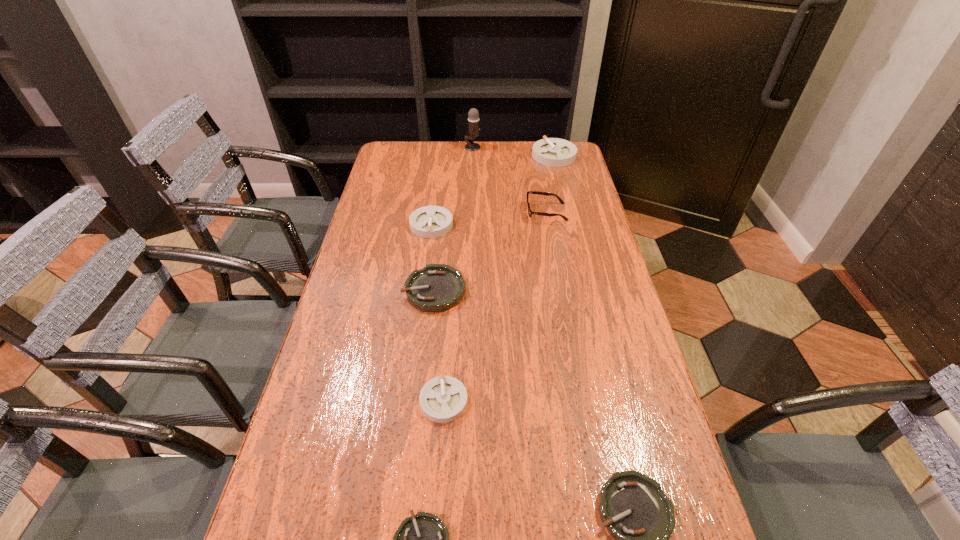
You are a GUI agent. You are given a task and a screenshot of the screen. Output one action in this format:
    pyautogui.click(x=<x>, y=<y>)
    Task: Click on the gray microphone
    Image resolution: width=960 pixels, height=540 pixels.
    Given the screenshot: What is the action you would take?
    click(x=473, y=115)

I want to click on the tallest object, so click(473, 115).

Identify the location of the farthest gray ashtray. (554, 152).

The image size is (960, 540). Identify the location of the tallest ashtray. (554, 152).

What are the coordinates of `spectacles` in the screenshot? It's located at (x=530, y=212).

Locate an element on the screen. the second nearest gray ashtray is located at coordinates (429, 221).

I want to click on the fourth tallest object, so click(x=429, y=221).

This screenshot has height=540, width=960. In order to click on the biggest green ashtray in this screenshot , I will do `click(437, 287)`.

The width and height of the screenshot is (960, 540). I want to click on the fourth nearest object, so click(437, 287).

At what (x,y) coordinates should I click in order to perform the action: click on the smallest gray ashtray. Please return your answer as a coordinate pair (x, y). The image size is (960, 540). Looking at the image, I should click on (443, 399).